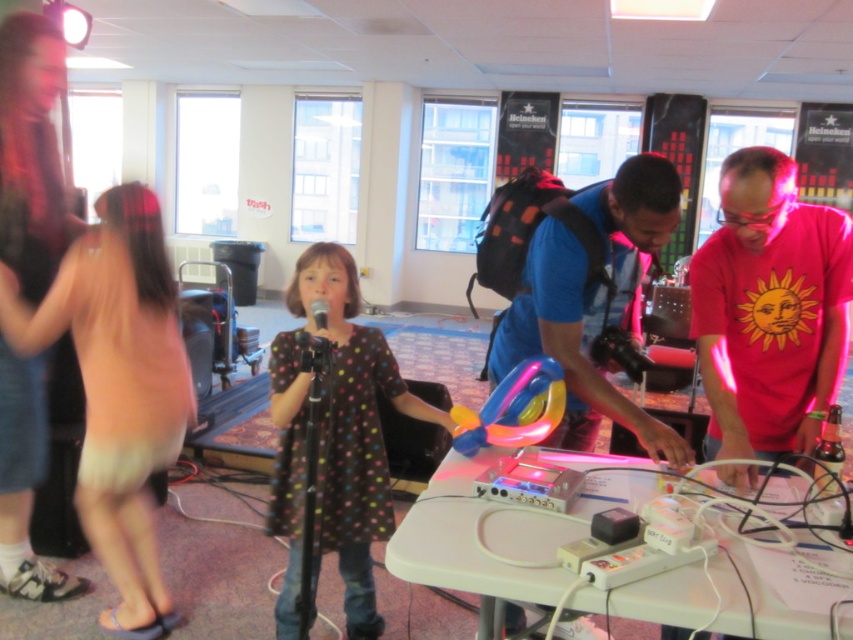
You are a photographer positioned in front of the scene. You need to capture a photo that includes both the pink satin dress at left and the black matte microphone at center. Which object should you place closer to the left side of your camera frame?

The pink satin dress at left should be placed closer to the left side of your camera frame since it is positioned to the left of the black matte microphone at center in the scene.

You are standing at point A located at point (315, 314) and want to move to point B located at point (350, 264). Can you walk directly from point A to point B without any obstacles?

Point (350, 264) is behind point (315, 314), so you cannot walk directly from point A to point B without any obstacles.